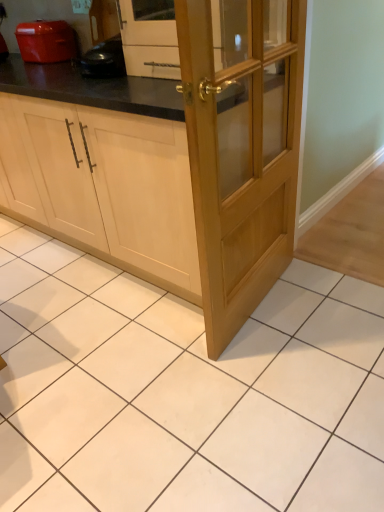
Find the location of `light wood cabinet at center`. light wood cabinet at center is located at coordinates (178, 163).

Locate an element on the screen. The width and height of the screenshot is (384, 512). matte orange toaster at upper left is located at coordinates (46, 41).

The image size is (384, 512). Find the location of `light wood/glass door at center`. light wood/glass door at center is located at coordinates (241, 160).

From the image's perspective, is matte orange toaster at upper left below light wood/glass door at center?

No, from the image's perspective, matte orange toaster at upper left is not beneath light wood/glass door at center.

From a real-world perspective, between matte orange toaster at upper left and light wood/glass door at center, who is vertically lower?

light wood/glass door at center is physically lower.

Which of these two, matte orange toaster at upper left or light wood/glass door at center, stands taller?

With more height is light wood/glass door at center.

Where is `door in front of the light wood cabinet at center`? This screenshot has width=384, height=512. door in front of the light wood cabinet at center is located at coordinates (241, 160).

Is light wood cabinet at center at the right side of light wood/glass door at center?

In fact, light wood cabinet at center is to the left of light wood/glass door at center.

Does point (229, 1) come farther from viewer compared to point (277, 274)?

No, (229, 1) is in front of (277, 274).

Between light wood cabinet at center and light wood/glass door at center, which one has smaller size?

Smaller between the two is light wood/glass door at center.

Between matte orange toaster at upper left and light wood cabinet at center, which one is positioned in front?

light wood cabinet at center is in front.

Measure the distance from matte orange toaster at upper left to light wood cabinet at center.

matte orange toaster at upper left is 92.94 centimeters from light wood cabinet at center.

Is matte orange toaster at upper left positioned with its back to light wood cabinet at center?

matte orange toaster at upper left does not have its back to light wood cabinet at center.

Locate an element on the screen. The height and width of the screenshot is (512, 384). home appliance located behind the light wood cabinet at center is located at coordinates (46, 41).

Are light wood cabinet at center and matte orange toaster at upper left far apart?

No, light wood cabinet at center is not far from matte orange toaster at upper left.

Considering the positions of points (150, 212) and (46, 59), is point (150, 212) farther from camera compared to point (46, 59)?

No.

From a real-world perspective, is light wood cabinet at center physically below matte orange toaster at upper left?

Indeed, from a real-world perspective, light wood cabinet at center is positioned beneath matte orange toaster at upper left.

Locate an element on the screen. The height and width of the screenshot is (512, 384). home appliance on the right of light wood cabinet at center is located at coordinates (46, 41).

From a real-world perspective, is light wood/glass door at center located higher than matte orange toaster at upper left?

No, from a real-world perspective, light wood/glass door at center is not over matte orange toaster at upper left

Is light wood/glass door at center in front of or behind matte orange toaster at upper left in the image?

light wood/glass door at center is positioned closer to the viewer than matte orange toaster at upper left.

From the picture: Considering the relative sizes of light wood/glass door at center and matte orange toaster at upper left in the image provided, is light wood/glass door at center thinner than matte orange toaster at upper left?

Yes, light wood/glass door at center is thinner than matte orange toaster at upper left.

From the image's perspective, which object appears higher, light wood/glass door at center or light wood cabinet at center?

From the image's view, light wood cabinet at center is above.

Consider the image. Between light wood/glass door at center and light wood cabinet at center, which one has less height?

With less height is light wood cabinet at center.

From a real-world perspective, is light wood/glass door at center above or below light wood cabinet at center?

From a real-world perspective, light wood/glass door at center is physically above light wood cabinet at center.

Locate an element on the screen. home appliance above the light wood/glass door at center (from the image's perspective) is located at coordinates (46, 41).

Identify the location of door in front of the light wood cabinet at center. This screenshot has width=384, height=512. (241, 160).

Looking at this image, considering their positions, is light wood/glass door at center positioned further to matte orange toaster at upper left than light wood cabinet at center?

light wood/glass door at center lies further to matte orange toaster at upper left than the other object.

Looking at the image, which one is located closer to light wood cabinet at center, matte orange toaster at upper left or light wood/glass door at center?

light wood/glass door at center lies closer to light wood cabinet at center than the other object.

Based on their spatial positions, is light wood cabinet at center or matte orange toaster at upper left further from light wood/glass door at center?

Among the two, matte orange toaster at upper left is located further to light wood/glass door at center.

From the image, which object appears to be nearer to matte orange toaster at upper left, light wood cabinet at center or light wood/glass door at center?

light wood cabinet at center is positioned closer to the anchor matte orange toaster at upper left.

Considering their positions, is light wood/glass door at center positioned closer to light wood cabinet at center than matte orange toaster at upper left?

light wood/glass door at center.

Which object lies further to the anchor point light wood/glass door at center, matte orange toaster at upper left or light wood cabinet at center?

Among the two, matte orange toaster at upper left is located further to light wood/glass door at center.

This screenshot has height=512, width=384. Find the location of `home appliance between light wood cabinet at center and light wood/glass door at center`. home appliance between light wood cabinet at center and light wood/glass door at center is located at coordinates (46, 41).